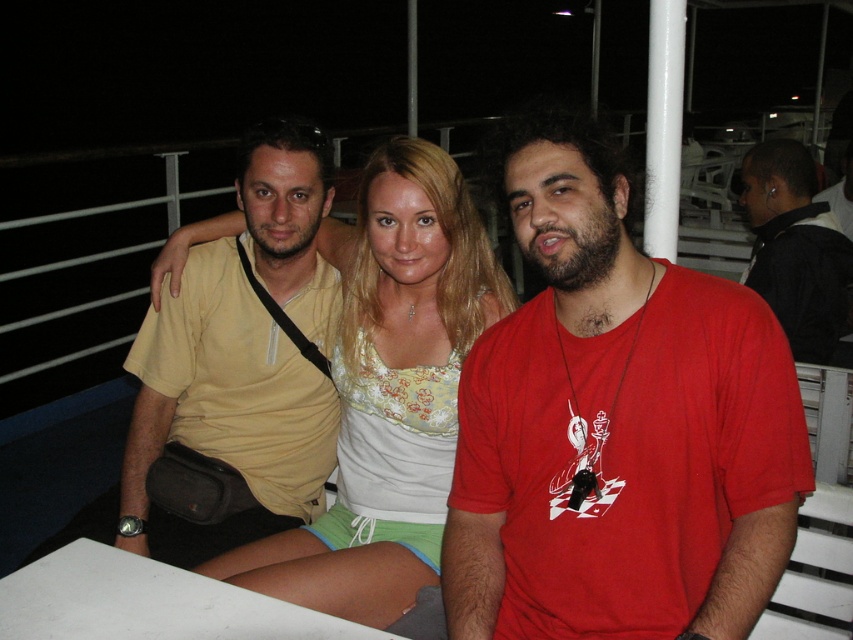
You are a photographer trying to capture a candid shot of the three people on the boat deck. You notice a specific point at coordinates [224,410]. What object is located at this point?

The point at coordinates [224,410] indicates the matte yellow shirt at center.